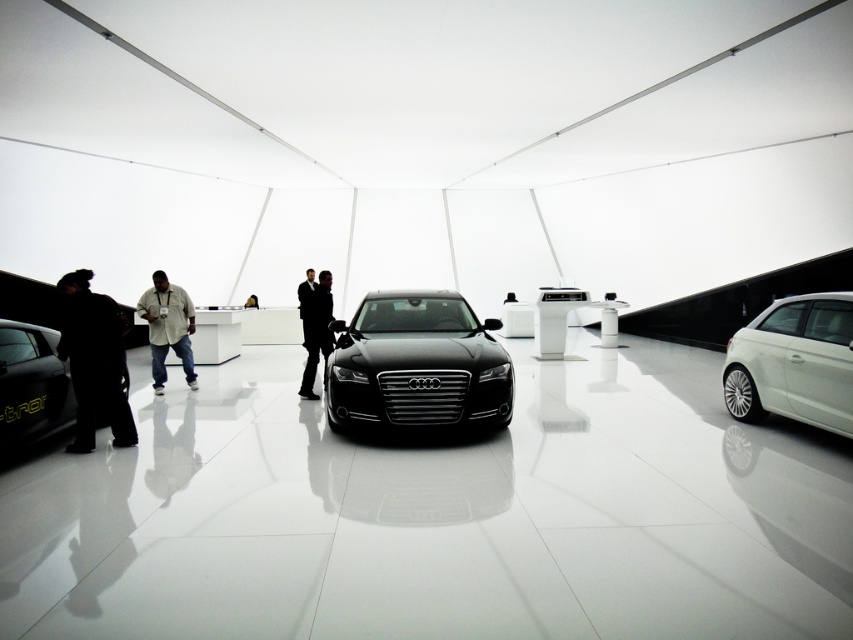
Is light beige shirt at center bigger than black suit at center?

Yes.

Which of these two, light beige shirt at center or black suit at center, stands shorter?

Standing shorter between the two is light beige shirt at center.

Is point (136, 308) in front of point (306, 392)?

No, (136, 308) is further to viewer.

This screenshot has height=640, width=853. I want to click on light beige shirt at center, so click(167, 326).

Is dark matte jacket at left thinner than black leather jacket at center?

Incorrect, dark matte jacket at left's width is not less than black leather jacket at center's.

Can you confirm if dark matte jacket at left is positioned below black leather jacket at center?

Yes.

Find the location of a particular element. Image resolution: width=853 pixels, height=640 pixels. dark matte jacket at left is located at coordinates (94, 360).

I want to click on dark matte jacket at left, so click(94, 360).

This screenshot has height=640, width=853. Find the location of `matte black car at lower left`. matte black car at lower left is located at coordinates (32, 385).

Is matte black car at lower left positioned behind black leather jacket at center?

No, matte black car at lower left is closer to the viewer.

What are the coordinates of `matte black car at lower left` in the screenshot? It's located at (32, 385).